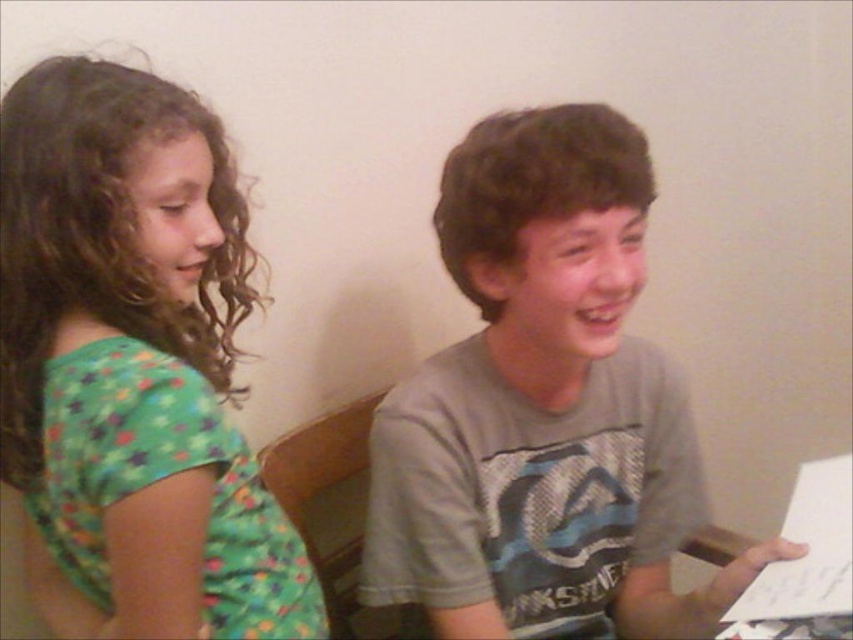
Who is more forward, (30, 378) or (515, 292)?

Point (30, 378) is in front.

Is green printed shirt at left taller than gray cotton shirt at center?

No, green printed shirt at left is not taller than gray cotton shirt at center.

Between point (62, 404) and point (462, 209), which one is positioned behind?

The point (462, 209) is more distant.

The width and height of the screenshot is (853, 640). I want to click on green printed shirt at left, so pos(132,365).